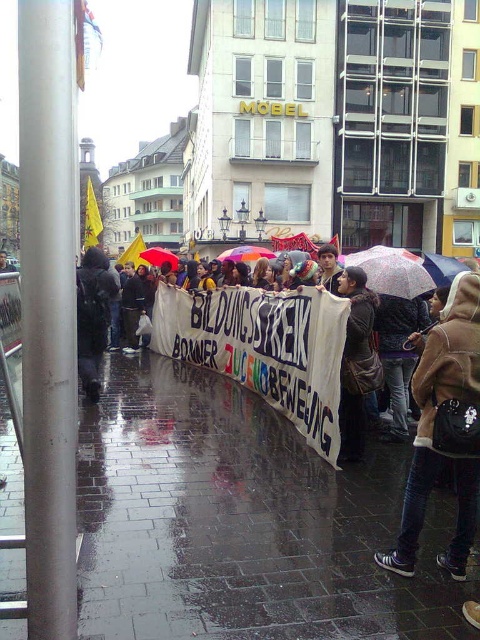
Question: Which point is closer to the camera taking this photo?

Choices:
 (A) 466,381
 (B) 412,285

Answer: (A)

Question: Which of these objects is positioned farthest from the dark gray jacket at left?

Choices:
 (A) yellow matte umbrella at center
 (B) brown fuzzy coat at lower right
 (C) floral-patterned fabric umbrella at center

Answer: (A)

Question: Does dark gray jacket at left appear on the right side of yellow matte umbrella at center?

Choices:
 (A) yes
 (B) no

Answer: (A)

Question: Does brown fuzzy coat at lower right have a smaller size compared to yellow matte umbrella at center?

Choices:
 (A) yes
 (B) no

Answer: (A)

Question: Which object is closer to the camera taking this photo?

Choices:
 (A) floral-patterned fabric umbrella at center
 (B) brown fuzzy coat at lower right
 (C) wet brick pavement at lower center

Answer: (C)

Question: Can you confirm if floral-patterned fabric umbrella at center is positioned to the left of yellow matte umbrella at center?

Choices:
 (A) no
 (B) yes

Answer: (A)